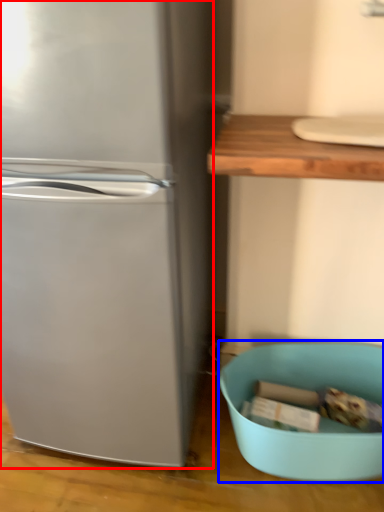
Question: Among these objects, which one is nearest to the camera, refrigerator (highlighted by a red box) or mixing bowl (highlighted by a blue box)?

Choices:
 (A) refrigerator
 (B) mixing bowl

Answer: (A)